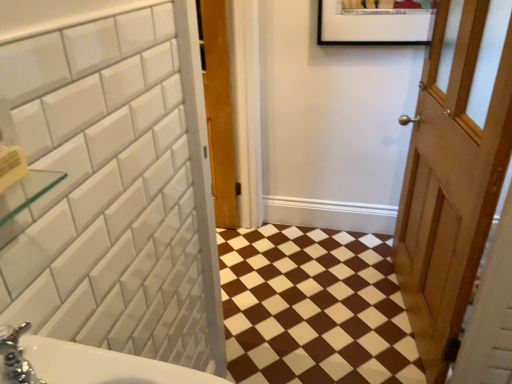
Question: Is brown glossy tile at center in front of or behind wooden door at right in the image?

Choices:
 (A) front
 (B) behind

Answer: (B)

Question: Considering the relative positions of brown glossy tile at center and wooden door at right in the image provided, is brown glossy tile at center to the left or to the right of wooden door at right?

Choices:
 (A) right
 (B) left

Answer: (B)

Question: Is brown glossy tile at center taller or shorter than wooden door at right?

Choices:
 (A) short
 (B) tall

Answer: (A)

Question: From a real-world perspective, relative to brown glossy tile at center, is wooden door at right vertically above or below?

Choices:
 (A) below
 (B) above

Answer: (B)

Question: In terms of height, does wooden door at right look taller or shorter compared to brown glossy tile at center?

Choices:
 (A) tall
 (B) short

Answer: (A)

Question: Considering their positions, is wooden door at right located in front of or behind brown glossy tile at center?

Choices:
 (A) front
 (B) behind

Answer: (A)

Question: From the image's perspective, is wooden door at right located above or below brown glossy tile at center?

Choices:
 (A) below
 (B) above

Answer: (B)